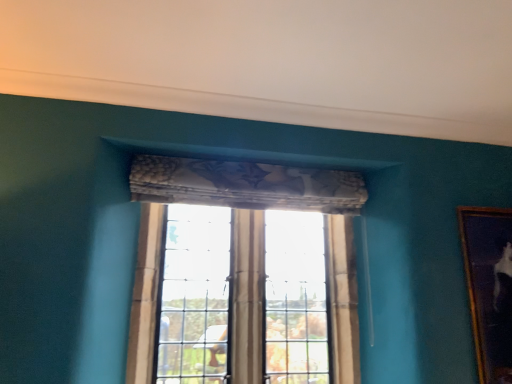
Question: From the image's perspective, relative to clear glass window at center, is gold-framed painting at right above or below?

Choices:
 (A) above
 (B) below

Answer: (A)

Question: Looking at their shapes, would you say gold-framed painting at right is wider or thinner than clear glass window at center?

Choices:
 (A) wide
 (B) thin

Answer: (B)

Question: Looking at the image, does gold-framed painting at right seem bigger or smaller compared to clear glass window at center?

Choices:
 (A) small
 (B) big

Answer: (A)

Question: From the image's perspective, is clear glass window at center above or below gold-framed painting at right?

Choices:
 (A) above
 (B) below

Answer: (B)

Question: Visually, is clear glass window at center positioned to the left or to the right of gold-framed painting at right?

Choices:
 (A) left
 (B) right

Answer: (A)

Question: From their relative heights in the image, would you say clear glass window at center is taller or shorter than gold-framed painting at right?

Choices:
 (A) short
 (B) tall

Answer: (B)

Question: Considering the positions of clear glass window at center and gold-framed painting at right in the image, is clear glass window at center bigger or smaller than gold-framed painting at right?

Choices:
 (A) small
 (B) big

Answer: (B)